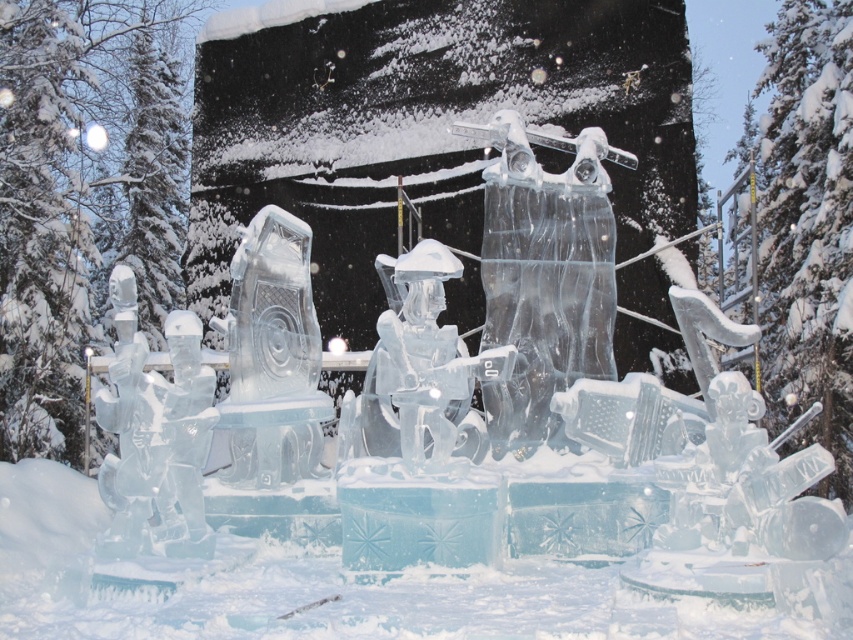
You are an ice sculptor who wants to place a small decoration between the transparent ice snow at center and the clear ice harp at center. Which object should you place the decoration closer to to ensure it fits within the space?

The transparent ice snow at center is bigger than the clear ice harp at center, so you should place the decoration closer to the clear ice harp at center to ensure it fits within the space.

You are an ice sculptor who wants to place a new ice statue between the transparent ice snow at center and the transparent ice figure at center. Which one should you move to make space?

The transparent ice snow at center might be wider than transparent ice figure at center, so you should move the transparent ice snow at center to create more space for the new statue.